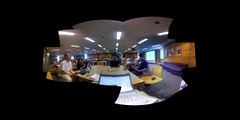
Where is `wooden chair`? wooden chair is located at coordinates (49, 74), (156, 72).